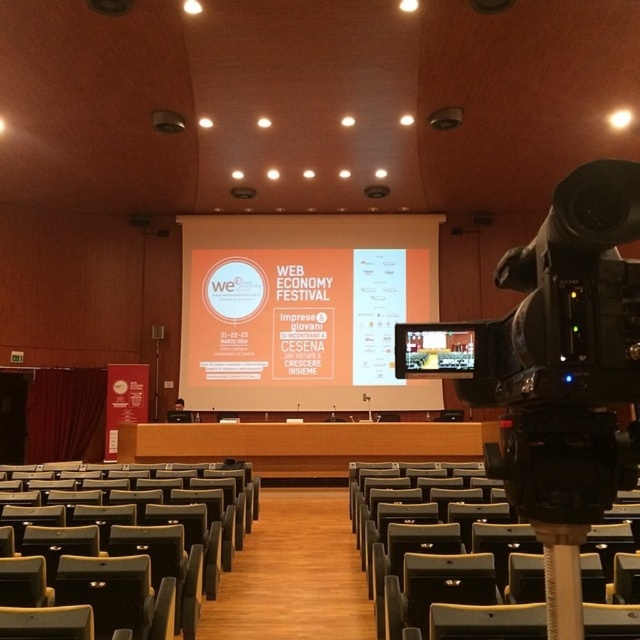
You are standing at the back of the conference hall and want to take a photo of the stage. There are two points marked on the screen for reference. Which point, point 1 at coordinates (417, 289) or point 2 at coordinates (51, 524), is closer to the camera and should be focused on to ensure the photo is sharp?

Point 2 at coordinates (51, 524) is closer to the camera than point 1 at coordinates (417, 289), so focusing on point 2 will ensure the photo is sharp.

You are setting up for a presentation and need to decide which screen to use. The orange matte projection screen at center and the matte white screen at center are both available. Based on their sizes, which one should you choose if you want a wider screen?

The orange matte projection screen at center might be wider than matte white screen at center, so you should choose the orange matte projection screen at center for a wider screen.

You are setting up for a presentation and need to choose between the orange matte projection screen at center and the matte white screen at center. Which screen is taller?

The orange matte projection screen at center is much taller than the matte white screen at center.